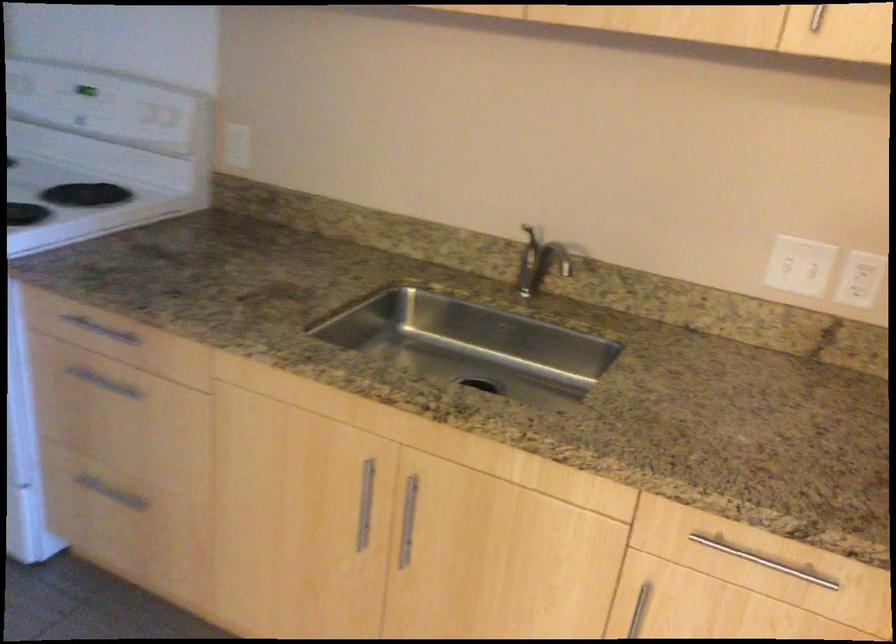
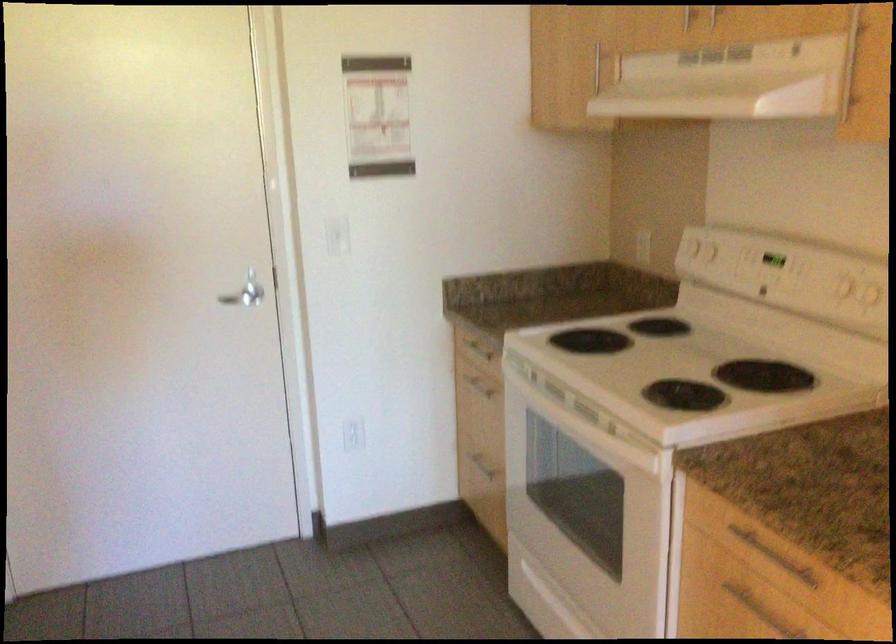
Question: Based on the continuous images, in which direction is the camera rotating? Reply with the corresponding letter.

Choices:
 (A) Left
 (B) Right
 (C) Up
 (D) Down

Answer: (A)